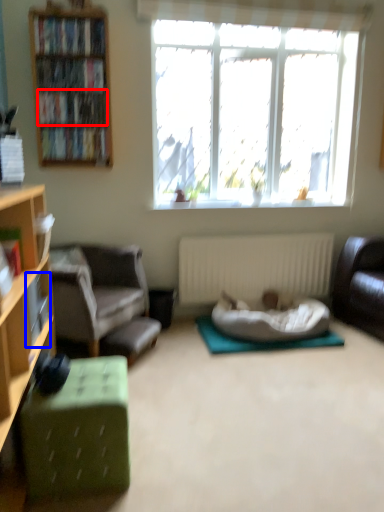
Question: Which object is further to the camera taking this photo, book (highlighted by a red box) or book (highlighted by a blue box)?

Choices:
 (A) book
 (B) book

Answer: (A)